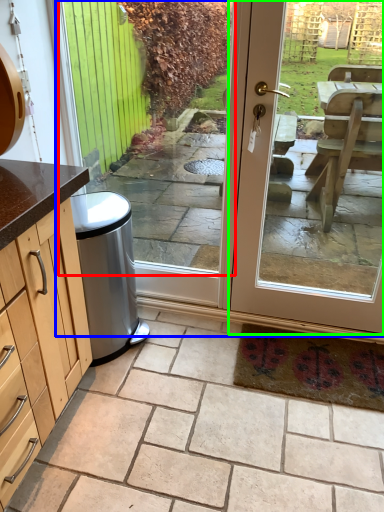
Question: Considering the real-world distances, which object is farthest from window (highlighted by a red box)? screen door (highlighted by a blue box) or door (highlighted by a green box)?

Choices:
 (A) screen door
 (B) door

Answer: (B)